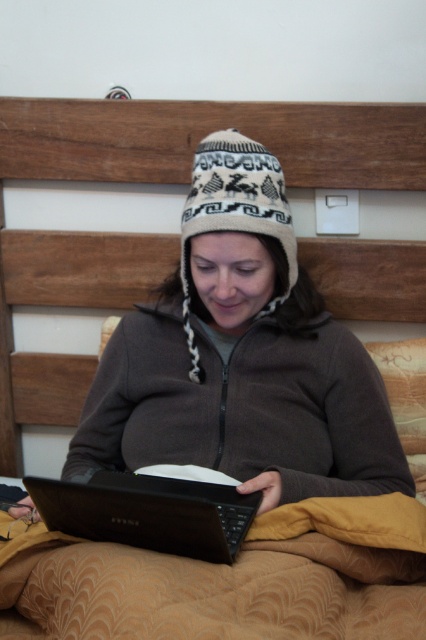
Is point (169, 506) in front of point (204, 164)?

Yes, it is in front of point (204, 164).

Does black matte laptop at center have a larger size compared to white knitted hat at center?

Actually, black matte laptop at center might be smaller than white knitted hat at center.

At what (x,y) coordinates should I click in order to perform the action: click on black matte laptop at center. Please return your answer as a coordinate pair (x, y). This screenshot has width=426, height=640. Looking at the image, I should click on (149, 513).